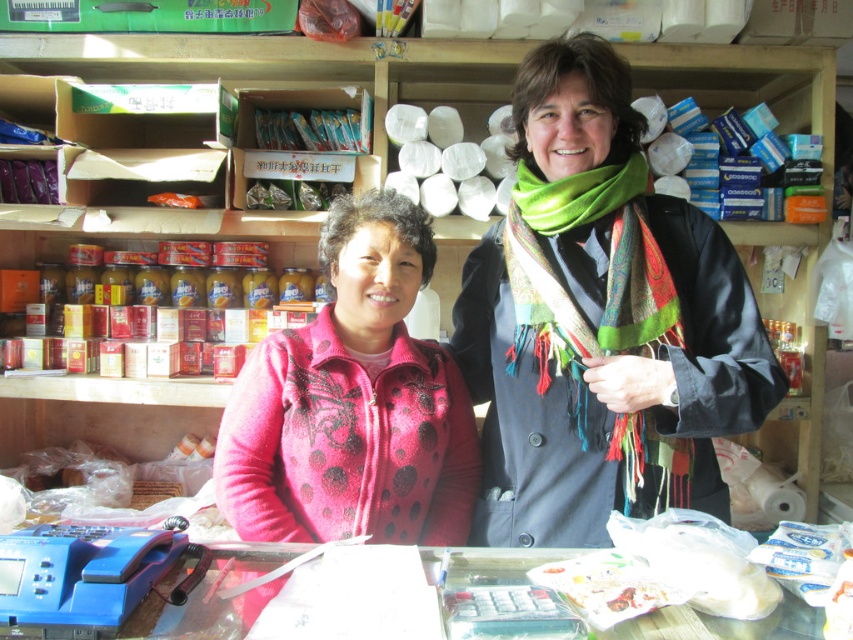
You are a customer entering the store and want to ask for directions. Which of the two staff members, the one wearing the pink dotted sweater at center or the one with the green woven scarf at center, is closer to you based on their positions?

The pink dotted sweater at center is closer to you because the green woven scarf at center is positioned behind it.

Please look at the point at coordinates (x=601, y=323). What object is located there?

The multicolored scarf at center is located at point (x=601, y=323).